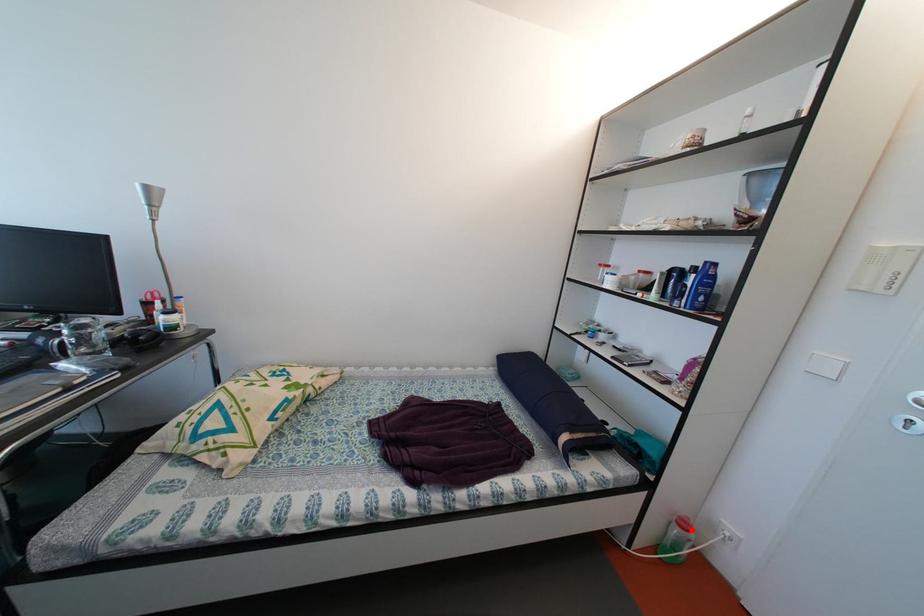
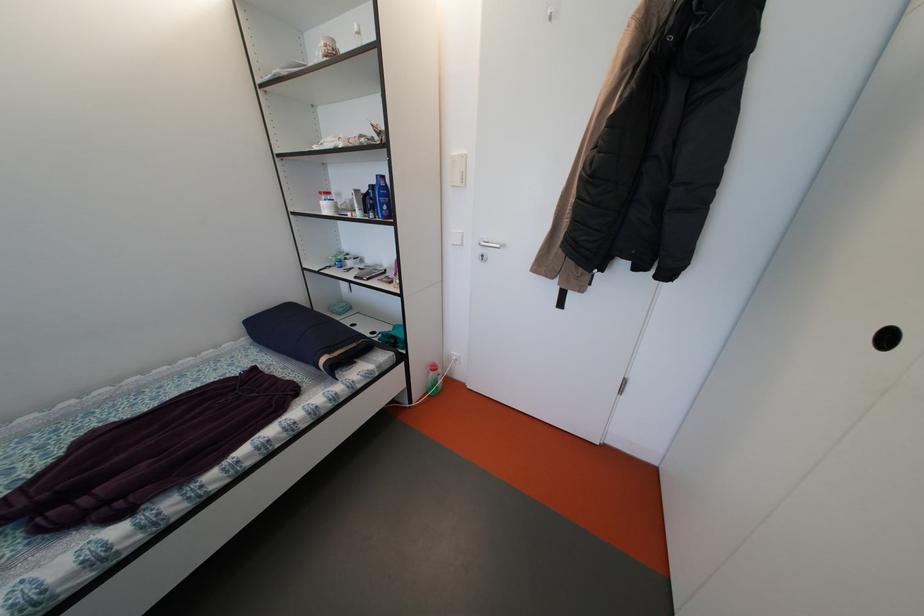
Find the pixel in the second image that matches the highlighted location in the first image.

(441, 373)